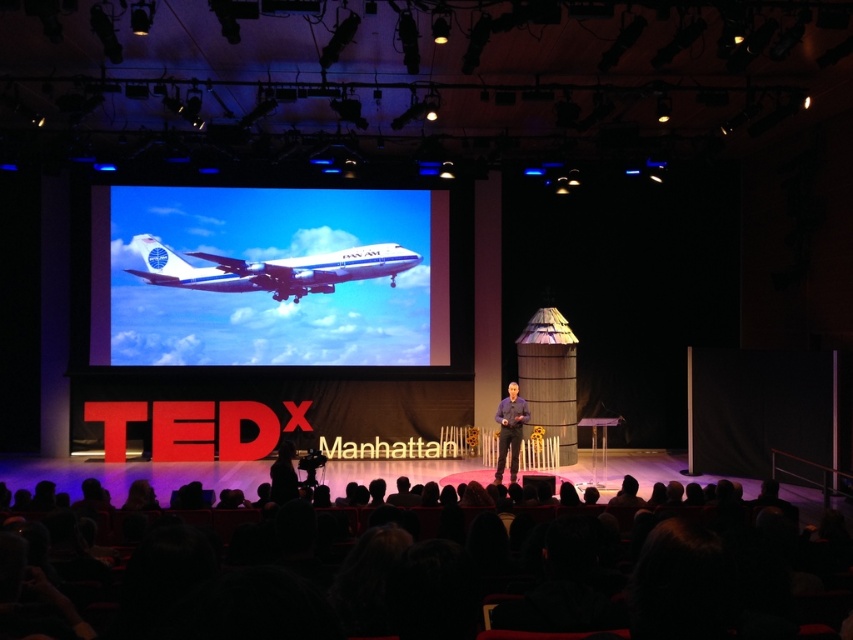
Question: Which point appears closest to the camera in this image?

Choices:
 (A) (309, 324)
 (B) (514, 481)

Answer: (B)

Question: Considering the real-world distances, which object is farthest from the matte blue shirt at center?

Choices:
 (A) white glossy airplane at upper center
 (B) white glossy airplane at center
 (C) silky black hair at lower center
 (D) dark blue shirt at lower center

Answer: (C)

Question: Considering the relative positions of white glossy airplane at center and silky black hair at lower center in the image provided, where is white glossy airplane at center located with respect to silky black hair at lower center?

Choices:
 (A) below
 (B) above

Answer: (B)

Question: In this image, where is white glossy airplane at upper center located relative to silky black hair at lower center?

Choices:
 (A) right
 (B) left

Answer: (B)

Question: Which point is farther from the camera taking this photo?

Choices:
 (A) (521, 413)
 (B) (170, 268)
 (C) (276, 477)

Answer: (B)

Question: Is white glossy airplane at upper center smaller than silky black hair at lower center?

Choices:
 (A) yes
 (B) no

Answer: (A)